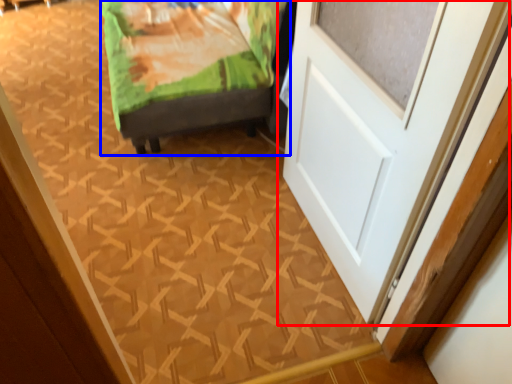
Question: Which object is closer to the camera taking this photo, door (highlighted by a red box) or furniture (highlighted by a blue box)?

Choices:
 (A) door
 (B) furniture

Answer: (A)